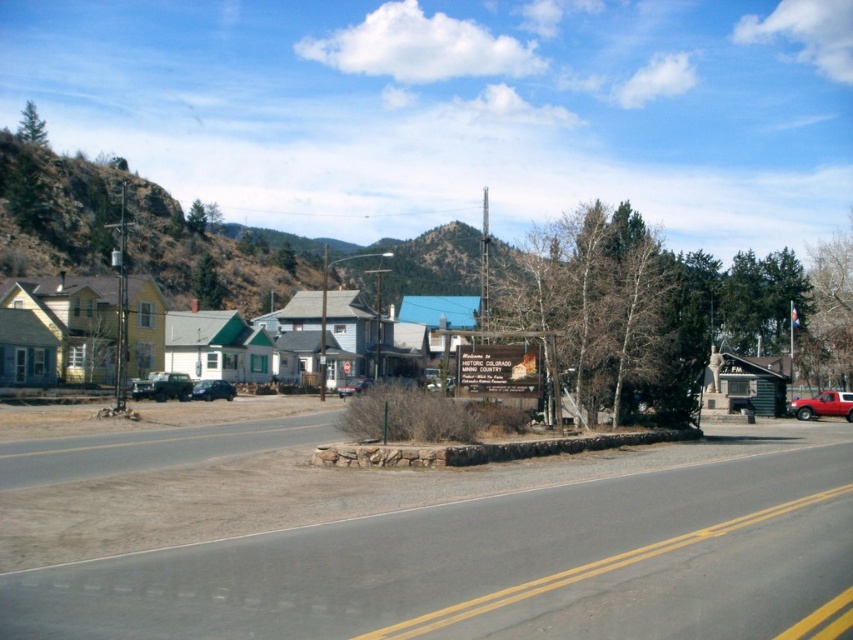
Question: Does yellow wood houses at center appear under metallic silver car at center?

Choices:
 (A) yes
 (B) no

Answer: (B)

Question: Can you confirm if yellow wood houses at center is positioned above metallic silver sedan at center?

Choices:
 (A) yes
 (B) no

Answer: (A)

Question: Is red matte truck at right to the right of metallic silver sedan at center from the viewer's perspective?

Choices:
 (A) no
 (B) yes

Answer: (B)

Question: Which point is farther to the camera?

Choices:
 (A) (221, 381)
 (B) (808, 404)
 (C) (343, 388)
 (D) (372, 336)

Answer: (D)

Question: Which point is closer to the camera?

Choices:
 (A) (216, 397)
 (B) (351, 317)
 (C) (351, 378)

Answer: (A)

Question: Which object appears closest to the camera in this image?

Choices:
 (A) metallic silver sedan at center
 (B) metallic silver car at center
 (C) red matte truck at right
 (D) yellow wood houses at center

Answer: (C)